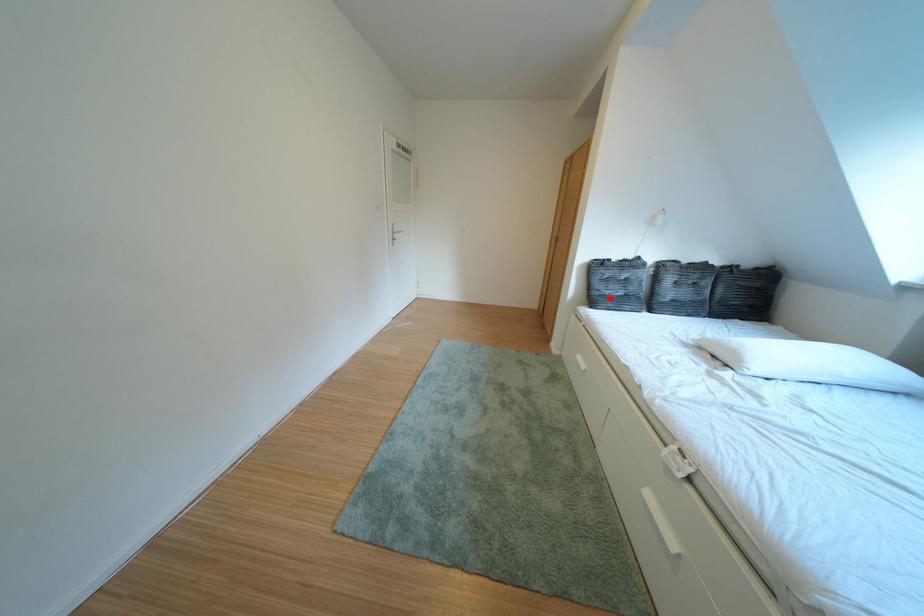
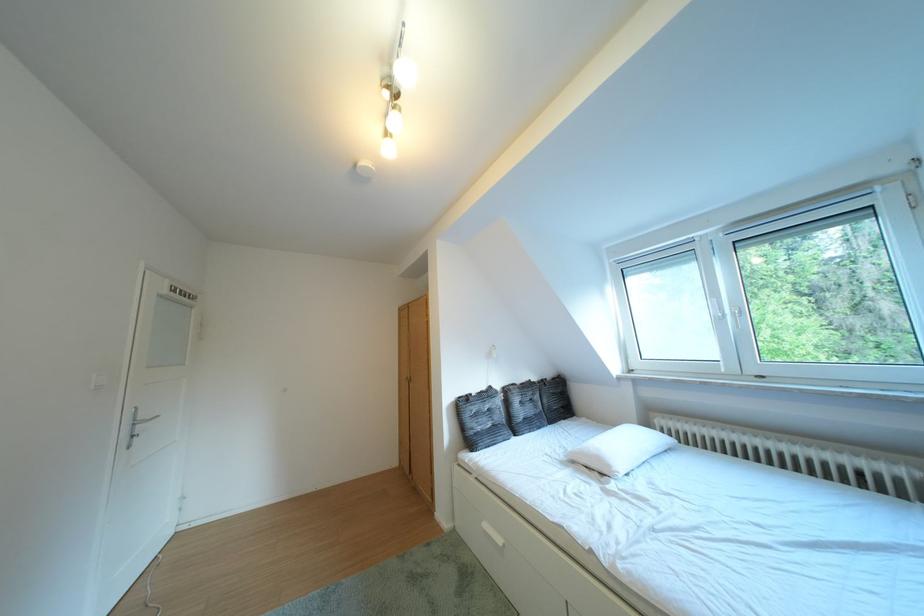
Find the pixel in the second image that matches the highlighted location in the first image.

(484, 438)